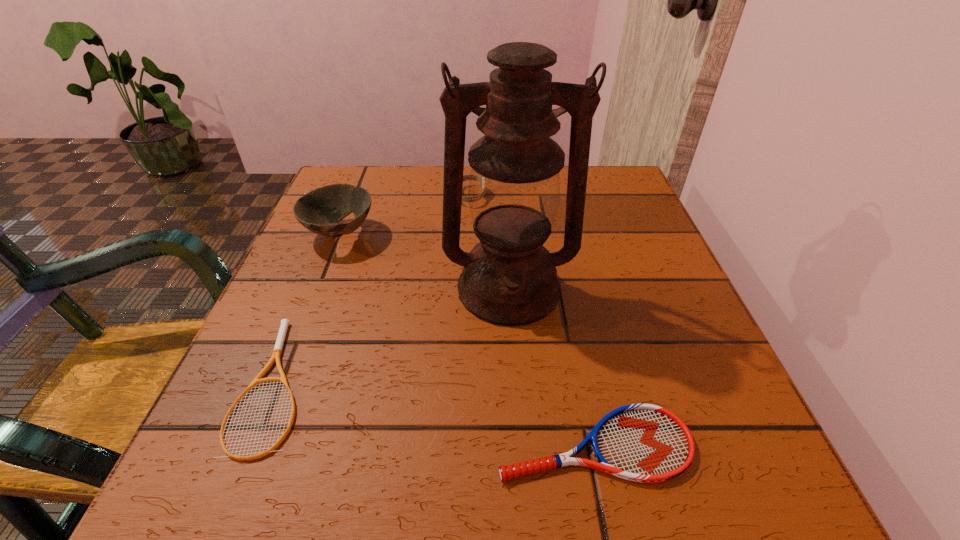
Where is `free space between the watch and the left tennis racket`? The width and height of the screenshot is (960, 540). free space between the watch and the left tennis racket is located at coordinates (373, 289).

This screenshot has height=540, width=960. I want to click on free space that is in between the shorter tennis racket and the bowl, so click(x=308, y=308).

Find the location of a particular element. free spot between the watch and the shorter tennis racket is located at coordinates (373, 289).

Where is `unoccupied position between the fourth shortest object and the watch`? The height and width of the screenshot is (540, 960). unoccupied position between the fourth shortest object and the watch is located at coordinates (405, 215).

Select which object is the closest to the tallest object. Please provide its 2D coordinates. Your answer should be formatted as a tuple, i.e. [(x, y)], where the tuple contains the x and y coordinates of a point satisfying the conditions above.

[(646, 443)]

Select which object is the second closest to the left tennis racket. Please provide its 2D coordinates. Your answer should be formatted as a tuple, i.e. [(x, y)], where the tuple contains the x and y coordinates of a point satisfying the conditions above.

[(509, 278)]

The image size is (960, 540). I want to click on vacant point that satisfies the following two spatial constraints: 1. on the back side of the second shortest object; 2. on the face of the watch, so click(x=544, y=195).

The image size is (960, 540). In order to click on vacant position in the image that satisfies the following two spatial constraints: 1. on the face of the third shortest object; 2. on the left side of the second shortest object in this screenshot , I will do `click(464, 444)`.

The width and height of the screenshot is (960, 540). I want to click on free space that satisfies the following two spatial constraints: 1. on the front side of the second shortest object; 2. on the left side of the left tennis racket, so click(252, 444).

The image size is (960, 540). Identify the location of vacant space that satisfies the following two spatial constraints: 1. on the face of the watch; 2. on the front side of the shorter tennis racket. (466, 383).